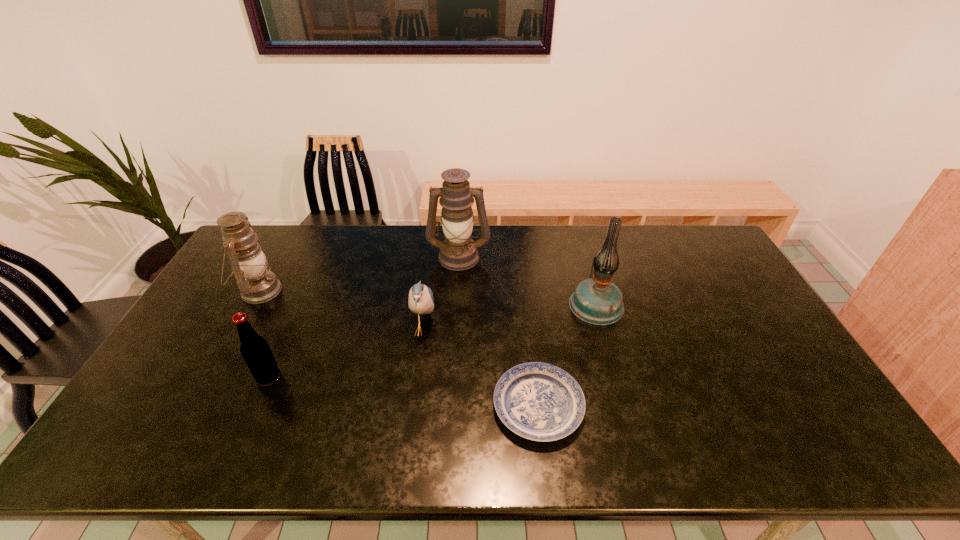
Identify the location of free space located 0.360m on the front of the leftmost object. This screenshot has height=540, width=960. click(191, 415).

You are a GUI agent. You are given a task and a screenshot of the screen. Output one action in this format:
    pyautogui.click(x=<x>, y=<y>)
    Task: Click on the blank space located on the right of the beer bottle
    
    Given the screenshot: What is the action you would take?
    pyautogui.click(x=363, y=377)

Image resolution: width=960 pixels, height=540 pixels. I want to click on vacant space positioned at the tip of the bird's beak, so click(x=553, y=329).

Locate an element on the screen. vacant space located on the right of the plate is located at coordinates (741, 406).

I want to click on object present at the far edge, so click(x=458, y=252).

Identify the location of object located at the near edge. Image resolution: width=960 pixels, height=540 pixels. (538, 401).

Locate an element on the screen. The height and width of the screenshot is (540, 960). object located in the left edge section of the desktop is located at coordinates (249, 261).

Locate an element on the screen. vacant space at the far edge is located at coordinates (540, 261).

Where is `vacant space at the near edge of the desktop`? vacant space at the near edge of the desktop is located at coordinates (592, 442).

The height and width of the screenshot is (540, 960). In order to click on free space at the right edge of the desktop in this screenshot , I will do `click(774, 357)`.